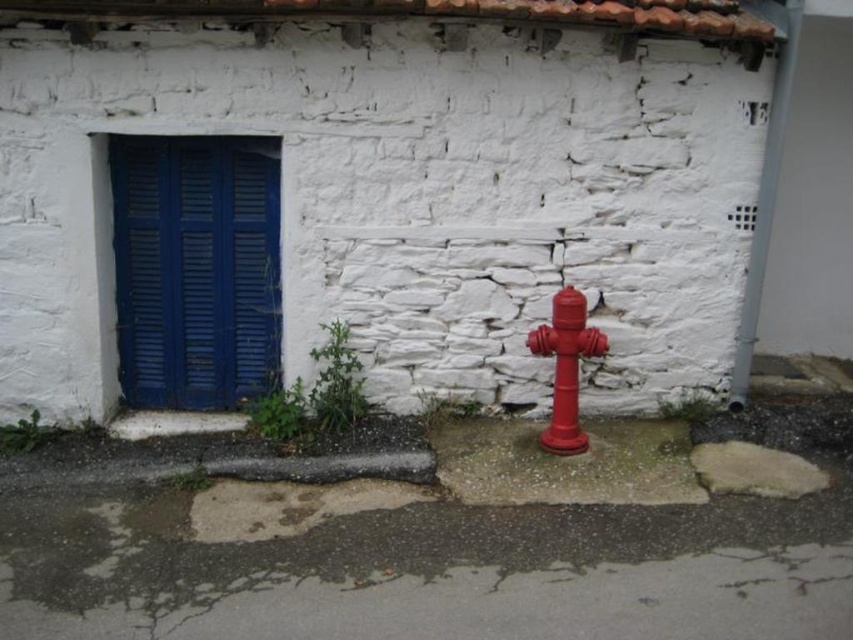
Question: Does blue painted wood at left have a greater width compared to smooth concrete curb at lower left?

Choices:
 (A) yes
 (B) no

Answer: (A)

Question: Among these objects, which one is farthest from the camera?

Choices:
 (A) smooth concrete curb at lower left
 (B) glossy metal hydrant at lower right
 (C) blue painted wood at left

Answer: (A)

Question: Among these points, which one is farthest from the camera?

Choices:
 (A) (569, 337)
 (B) (158, 364)
 (C) (171, 410)

Answer: (C)

Question: Observing the image, what is the correct spatial positioning of blue painted wood at left in reference to smooth concrete curb at lower left?

Choices:
 (A) right
 (B) left

Answer: (A)

Question: Which point is closer to the camera?

Choices:
 (A) (572, 358)
 (B) (212, 426)
 (C) (125, 356)

Answer: (A)

Question: Is blue painted wood at left smaller than smooth concrete curb at lower left?

Choices:
 (A) yes
 (B) no

Answer: (B)